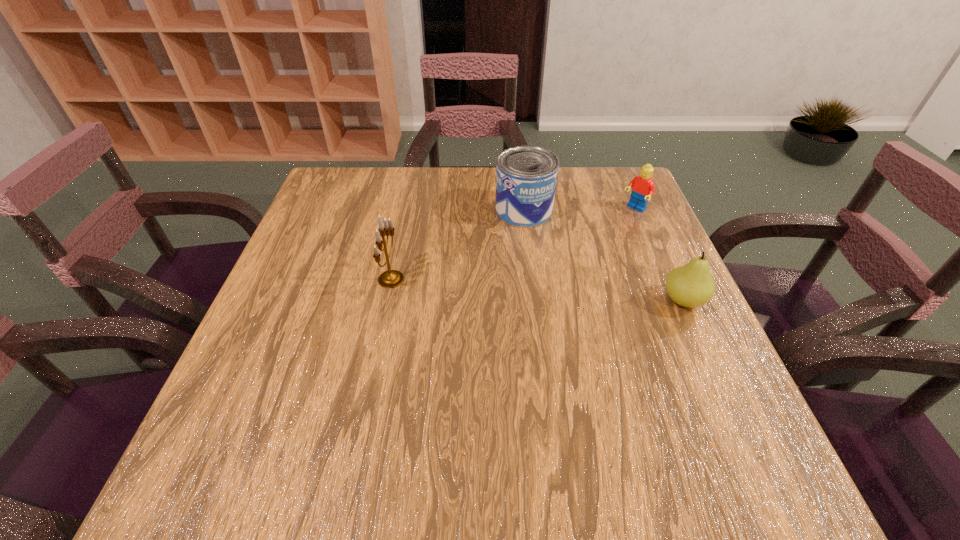
The image size is (960, 540). I want to click on vacant space at the left edge, so click(329, 335).

Find the location of a particular element. The height and width of the screenshot is (540, 960). free spot at the right edge of the desktop is located at coordinates (622, 231).

This screenshot has height=540, width=960. In order to click on vacant space at the far left corner of the desktop in this screenshot , I will do `click(372, 198)`.

You are a GUI agent. You are given a task and a screenshot of the screen. Output one action in this format:
    pyautogui.click(x=<x>, y=<y>)
    Task: Click on the vacant space at the far right corner of the desktop
    
    Given the screenshot: What is the action you would take?
    pyautogui.click(x=589, y=173)

Where is `free space between the Lego and the pear`? free space between the Lego and the pear is located at coordinates (659, 255).

Locate an element on the screen. free space between the Lego and the second object from left to right is located at coordinates (579, 210).

Locate an element on the screen. blank region between the can and the leftmost object is located at coordinates (458, 245).

You are a GUI agent. You are given a task and a screenshot of the screen. Output one action in this format:
    pyautogui.click(x=<x>, y=<y>)
    Task: Click on the free spot between the Lego and the can
    
    Given the screenshot: What is the action you would take?
    pyautogui.click(x=579, y=210)

Where is `free spot between the Lego and the pear`? The height and width of the screenshot is (540, 960). free spot between the Lego and the pear is located at coordinates (659, 255).

Image resolution: width=960 pixels, height=540 pixels. I want to click on free space between the candelabrum and the pear, so click(x=538, y=290).